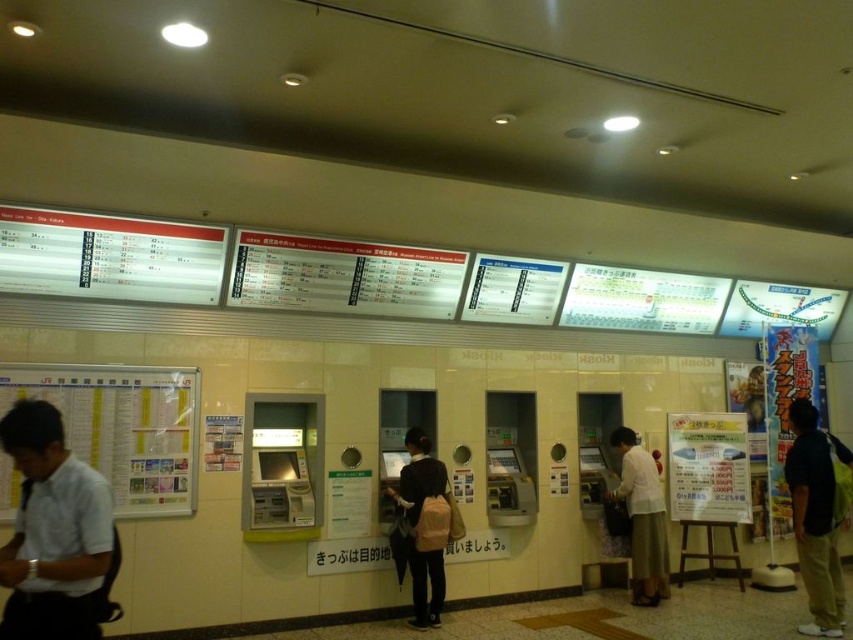
You are a traveler standing in front of the ticket vending machines. You notice a person wearing a dark blue shirt at right and another wearing a light beige skirt at center. Which person is closer to you?

The dark blue shirt at right is closer to the viewer than the light beige skirt at center.

You are a traveler standing in front of the ticket vending machines in the station. You notice two people wearing shirts of different colors. The person wearing the white shirt at left and the person wearing the dark blue shirt at right. Which person is shorter in height?

The white shirt at left has a lesser height compared to dark blue shirt at right, so the person wearing the white shirt at left is shorter.